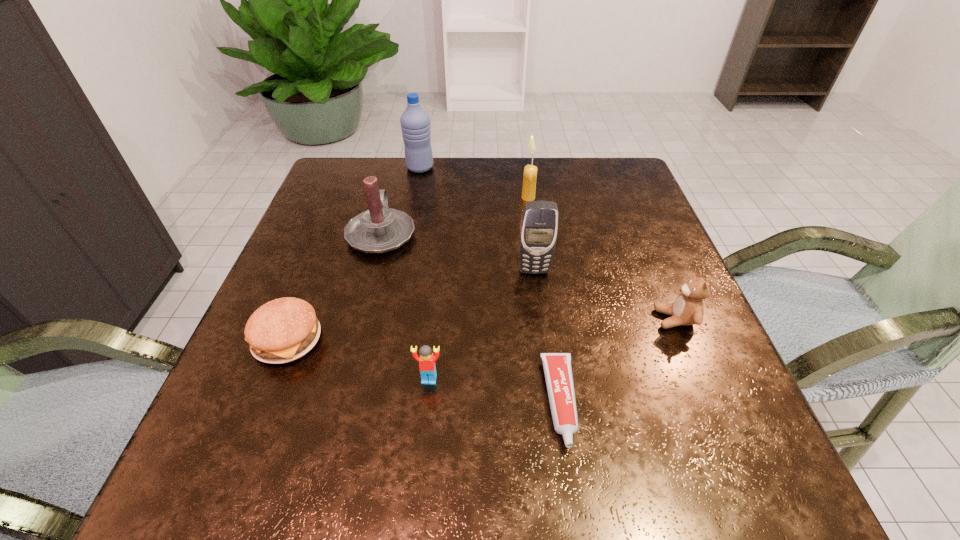
Locate an element on the screen. This screenshot has width=960, height=540. vacant space located 0.090m on the front-facing side of the fourth shortest object is located at coordinates (609, 319).

The width and height of the screenshot is (960, 540). I want to click on vacant area situated 0.150m on the face of the sixth tallest object, so click(420, 476).

Find the location of a particular element. The image size is (960, 540). free space located on the front of the hamburger is located at coordinates point(254,422).

You are a GUI agent. You are given a task and a screenshot of the screen. Output one action in this format:
    pyautogui.click(x=<x>, y=<y>)
    Task: Click on the water bottle situated at the far edge
    This screenshot has height=540, width=960.
    Given the screenshot: What is the action you would take?
    pyautogui.click(x=415, y=122)

You are a GUI agent. You are given a task and a screenshot of the screen. Output one action in this format:
    pyautogui.click(x=<x>, y=<y>)
    Task: Click on the candle present at the far edge
    The image size is (960, 540).
    Given the screenshot: What is the action you would take?
    pyautogui.click(x=530, y=171)

Where is `object situated at the near edge`? This screenshot has height=540, width=960. object situated at the near edge is located at coordinates (557, 366).

Where is `candle present at the left edge`? This screenshot has height=540, width=960. candle present at the left edge is located at coordinates (380, 229).

Where is `hamburger that is at the left edge`? hamburger that is at the left edge is located at coordinates (283, 330).

This screenshot has height=540, width=960. Identify the location of object that is at the right edge. (688, 308).

Find the location of a particular element. This screenshot has width=960, height=540. free space at the far edge is located at coordinates 500,197.